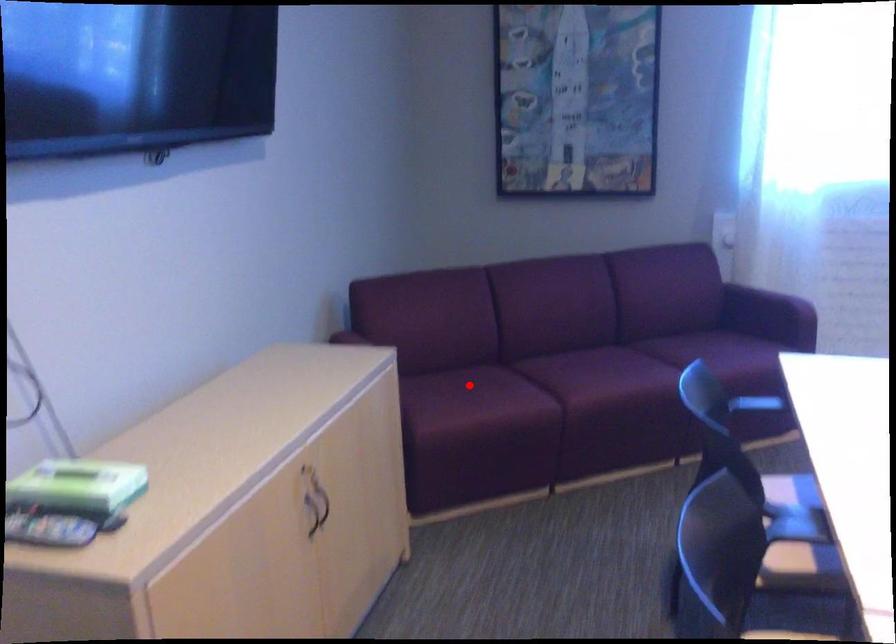
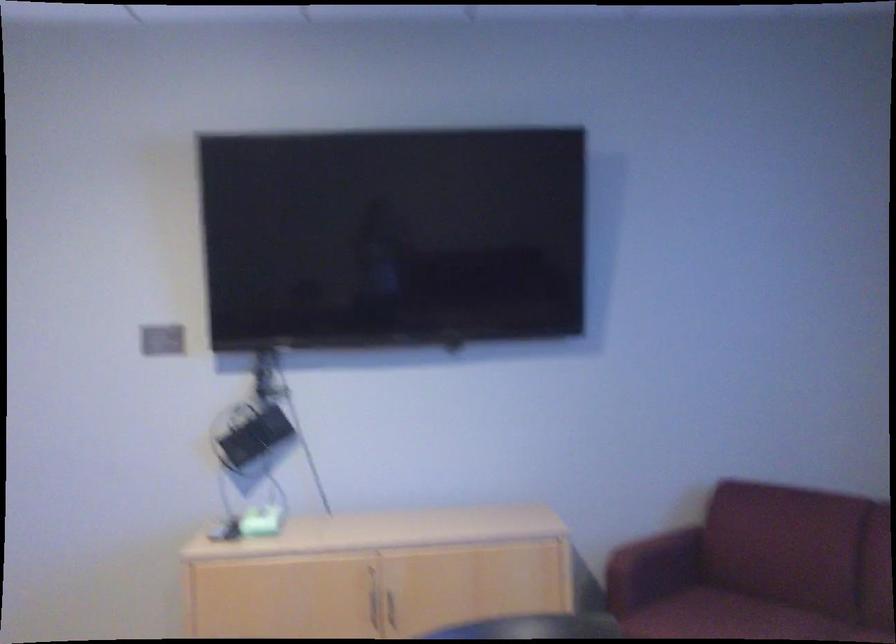
Question: I am providing you with two images of the same scene from different viewpoints. Image1 has a red point marked. In image2, the corresponding 3D location appears at what relative position? Reply with the corresponding letter.

Choices:
 (A) Closer
 (B) Farther

Answer: (A)